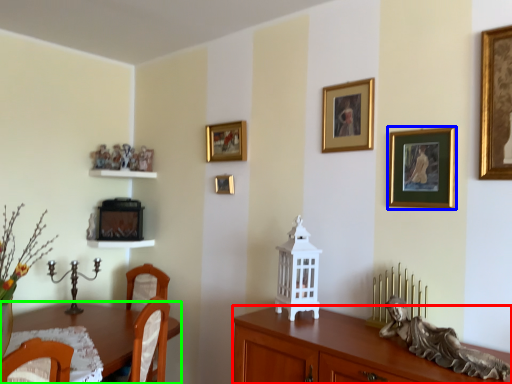
Question: Which object is the farthest from cabinetry (highlighted by a red box)? Choose among these: picture frame (highlighted by a blue box) or desk (highlighted by a green box).

Choices:
 (A) picture frame
 (B) desk

Answer: (B)